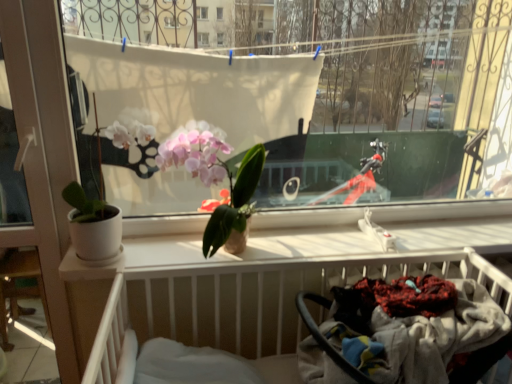
Question: Is pink matte orchid at center positioned before black rubber baby carriage at lower right?

Choices:
 (A) no
 (B) yes

Answer: (A)

Question: Can you confirm if pink matte orchid at center is smaller than black rubber baby carriage at lower right?

Choices:
 (A) no
 (B) yes

Answer: (B)

Question: Is pink matte orchid at center facing towards black rubber baby carriage at lower right?

Choices:
 (A) yes
 (B) no

Answer: (B)

Question: Does pink matte orchid at center appear on the left side of black rubber baby carriage at lower right?

Choices:
 (A) no
 (B) yes

Answer: (B)

Question: Is pink matte orchid at center completely or partially outside of black rubber baby carriage at lower right?

Choices:
 (A) no
 (B) yes

Answer: (B)

Question: Is pink matte orchid at center oriented away from black rubber baby carriage at lower right?

Choices:
 (A) yes
 (B) no

Answer: (B)

Question: Is black rubber baby carriage at lower right positioned with its back to pink matte orchid at center?

Choices:
 (A) yes
 (B) no

Answer: (B)

Question: From the image's perspective, is black rubber baby carriage at lower right above pink matte orchid at center?

Choices:
 (A) yes
 (B) no

Answer: (B)

Question: Is black rubber baby carriage at lower right aimed at pink matte orchid at center?

Choices:
 (A) no
 (B) yes

Answer: (A)

Question: Can you confirm if black rubber baby carriage at lower right is positioned to the left of pink matte orchid at center?

Choices:
 (A) yes
 (B) no

Answer: (B)

Question: Is black rubber baby carriage at lower right further to camera compared to pink matte orchid at center?

Choices:
 (A) no
 (B) yes

Answer: (A)

Question: Are black rubber baby carriage at lower right and pink matte orchid at center beside each other?

Choices:
 (A) no
 (B) yes

Answer: (A)

Question: Is white plastic screen door at left outside pink matte orchid at center?

Choices:
 (A) no
 (B) yes

Answer: (B)